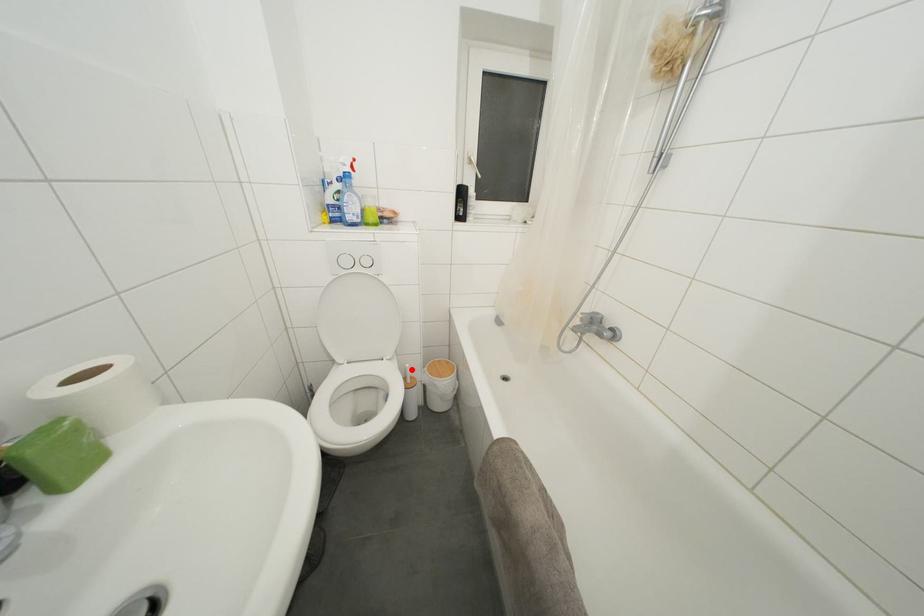
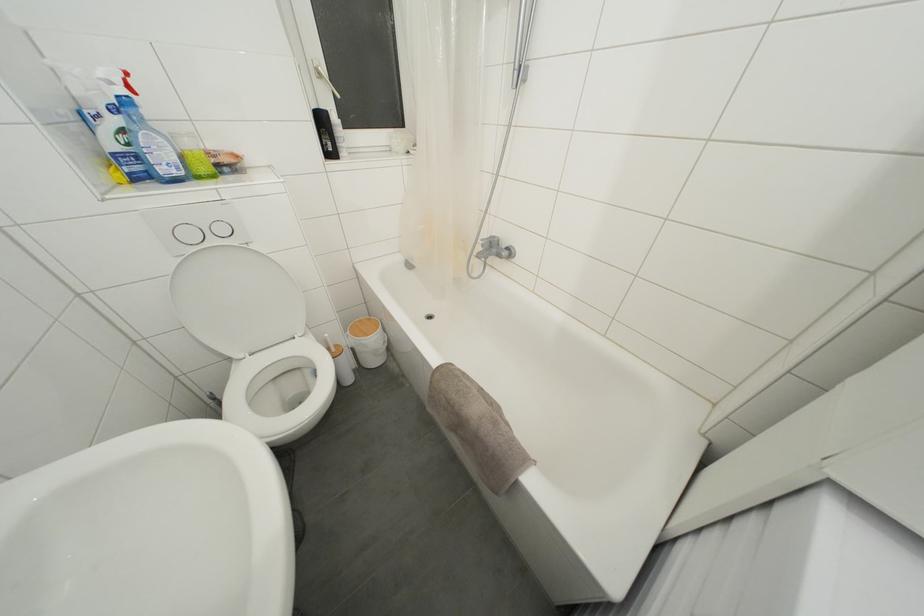
Question: I am providing you with two images of the same scene from different viewpoints. Image1 has a red point marked. In image2, the corresponding 3D location appears at what relative position? Reply with the corresponding letter.

Choices:
 (A) Closer
 (B) Farther

Answer: (A)